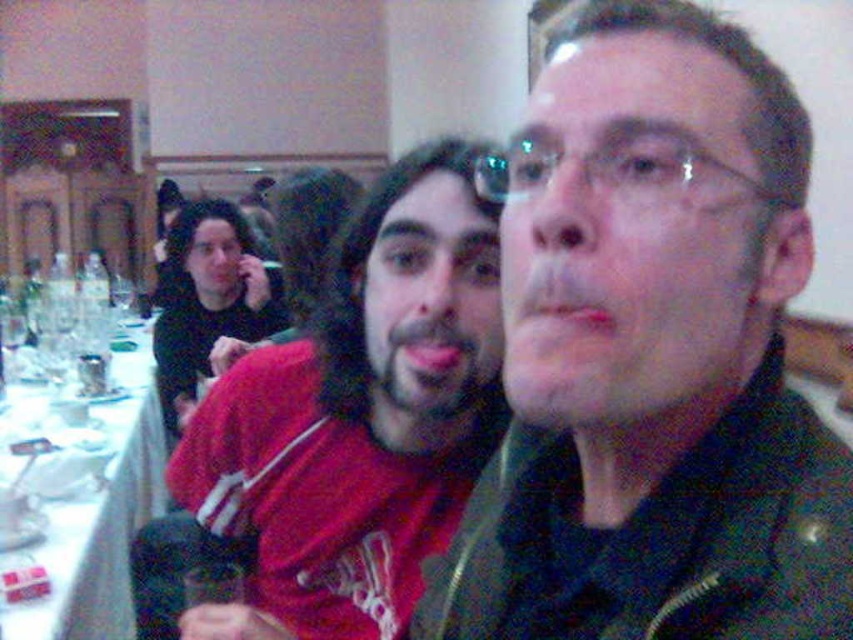
You are a photographer setting up for a group photo. You need to ensure that both the matte black jacket at center and the red matte shirt at center are visible in the frame. Based on their positions, which one should you focus on first to make sure both are in focus?

The matte black jacket at center is above the red matte shirt at center, so focusing on the matte black jacket at center first will ensure both are in focus as the red matte shirt at center is below it.

You are standing in the room and want to reach both the point at coordinates (155, 344) and the point at (619, 192). Which point should you reach first if you want to touch them in order from closest to farthest?

You should reach the point at coordinates (155, 344) first because it is closer to you than the point at (619, 192), which is further away.